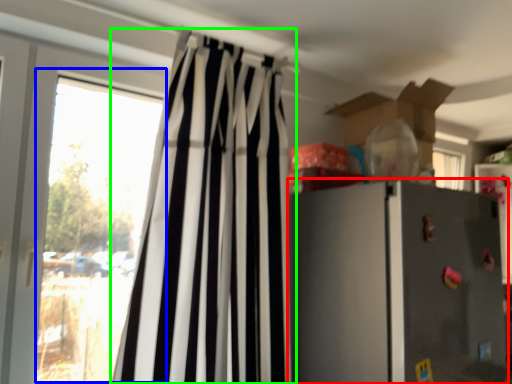
Question: Which is farther away from refrigerator (highlighted by a red box)? window (highlighted by a blue box) or curtain (highlighted by a green box)?

Choices:
 (A) window
 (B) curtain

Answer: (A)